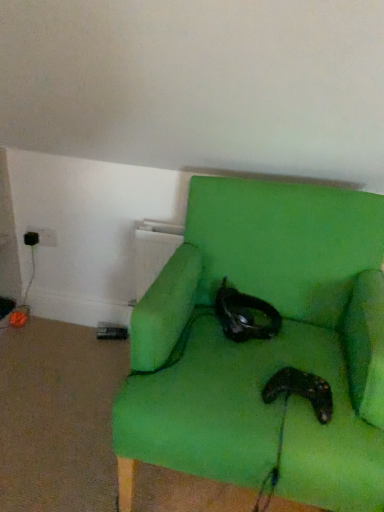
Question: From a real-world perspective, is black matte controller at lower center located beneath black matte cat at center?

Choices:
 (A) yes
 (B) no

Answer: (A)

Question: Is black matte controller at lower center shorter than black matte cat at center?

Choices:
 (A) no
 (B) yes

Answer: (B)

Question: Is black matte controller at lower center taller than black matte cat at center?

Choices:
 (A) yes
 (B) no

Answer: (B)

Question: Does black matte controller at lower center have a greater width compared to black matte cat at center?

Choices:
 (A) yes
 (B) no

Answer: (B)

Question: Considering the relative sizes of black matte controller at lower center and black matte cat at center in the image provided, is black matte controller at lower center smaller than black matte cat at center?

Choices:
 (A) yes
 (B) no

Answer: (A)

Question: Is black matte controller at lower center located outside black matte cat at center?

Choices:
 (A) no
 (B) yes

Answer: (B)

Question: Does black matte cat at center lie in front of green fabric chair at center?

Choices:
 (A) no
 (B) yes

Answer: (A)

Question: Can you confirm if black matte cat at center is thinner than green fabric chair at center?

Choices:
 (A) yes
 (B) no

Answer: (A)

Question: Is black matte cat at center bigger than green fabric chair at center?

Choices:
 (A) yes
 (B) no

Answer: (B)

Question: Does black matte cat at center have a greater height compared to green fabric chair at center?

Choices:
 (A) no
 (B) yes

Answer: (A)

Question: Does black matte cat at center have a greater width compared to green fabric chair at center?

Choices:
 (A) yes
 (B) no

Answer: (B)

Question: Is green fabric chair at center inside black matte cat at center?

Choices:
 (A) yes
 (B) no

Answer: (B)

Question: From a real-world perspective, is black matte cat at center on top of black matte controller at lower center?

Choices:
 (A) no
 (B) yes

Answer: (B)